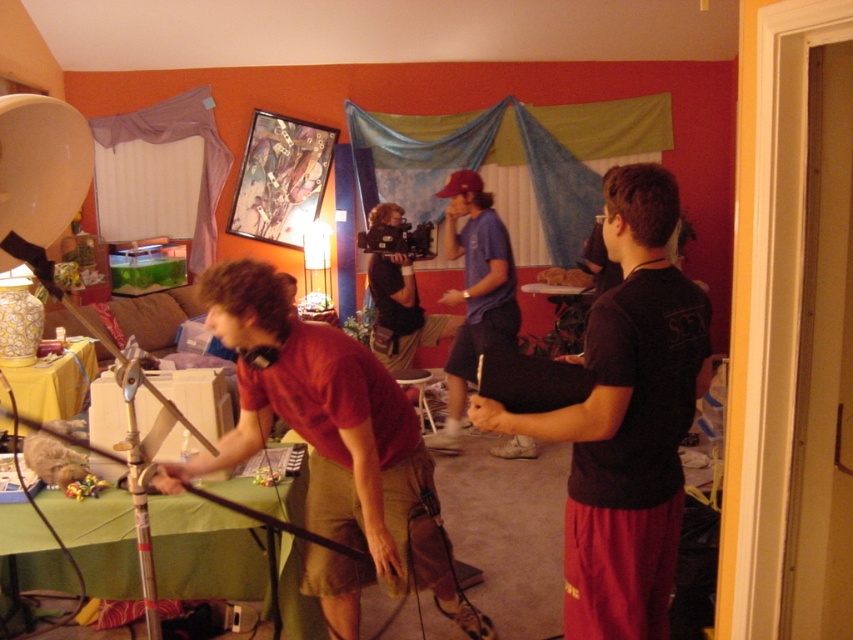
You are a photographer positioned at the back of the room. You want to take a photo of the matte blue shirt at center without the black matte shirt at center blocking the view. Is it possible to do so without moving any of the subjects?

The black matte shirt at center is in front of the matte blue shirt at center, so it would block the view. Therefore, it is not possible to take a photo of the matte blue shirt at center without the black matte shirt at center blocking the view without moving any subjects.

You are organizing a photo shoot and need to ensure that the two participants, the black matte shirt at center and the matte blue shirt at center, are positioned so that their clothing does not overlap in the frame. Given their sizes, which participant should be placed further back to avoid overlapping?

The black matte shirt at center has a larger width than the matte blue shirt at center. To prevent overlapping, the black matte shirt at center should be placed further back so that its larger size doesn

You are organizing a photo shoot and need to ensure that all participants are visible in the frame. Given that the matte red shirt at center and the matte blue shirt at center are both in the same area, which one might be more challenging to capture clearly due to its size?

The matte red shirt at center is smaller than the matte blue shirt at center, so it might be more challenging to capture clearly due to its smaller size.